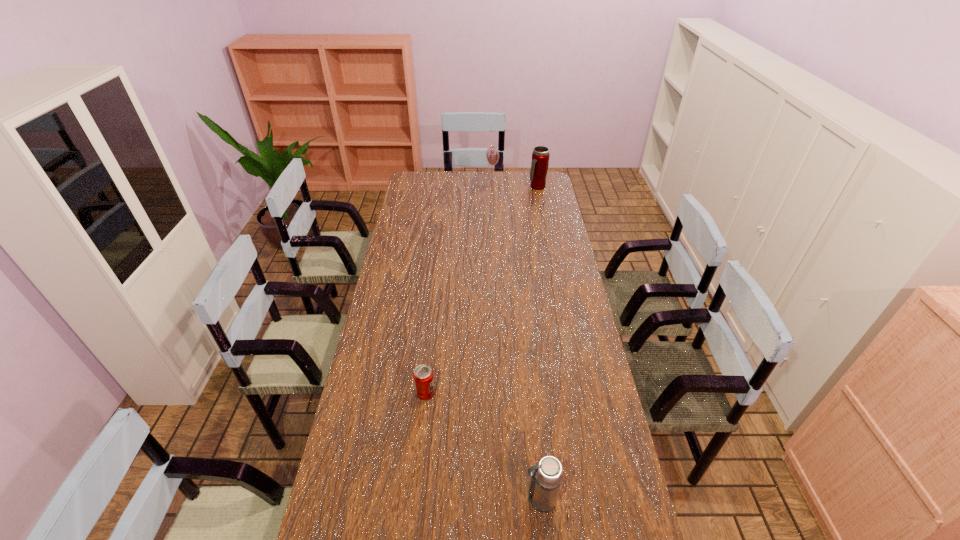
Identify the location of free space between the soda can and the rightmost object. (482, 290).

Identify which object is the second closest to the soda can. Please provide its 2D coordinates. Your answer should be formatted as a tuple, i.e. [(x, y)], where the tuple contains the x and y coordinates of a point satisfying the conditions above.

[(540, 157)]

At what (x,y) coordinates should I click in order to perform the action: click on the third closest object to the nearer thermos bottle. Please return your answer as a coordinate pair (x, y). This screenshot has width=960, height=540. Looking at the image, I should click on (492, 154).

Find the location of `free spot that satisfies the following two spatial constraints: 1. on the side with the handle of the farther thermos bottle; 2. with a handle on the side of the nearer thermos bottle`. free spot that satisfies the following two spatial constraints: 1. on the side with the handle of the farther thermos bottle; 2. with a handle on the side of the nearer thermos bottle is located at coordinates (598, 499).